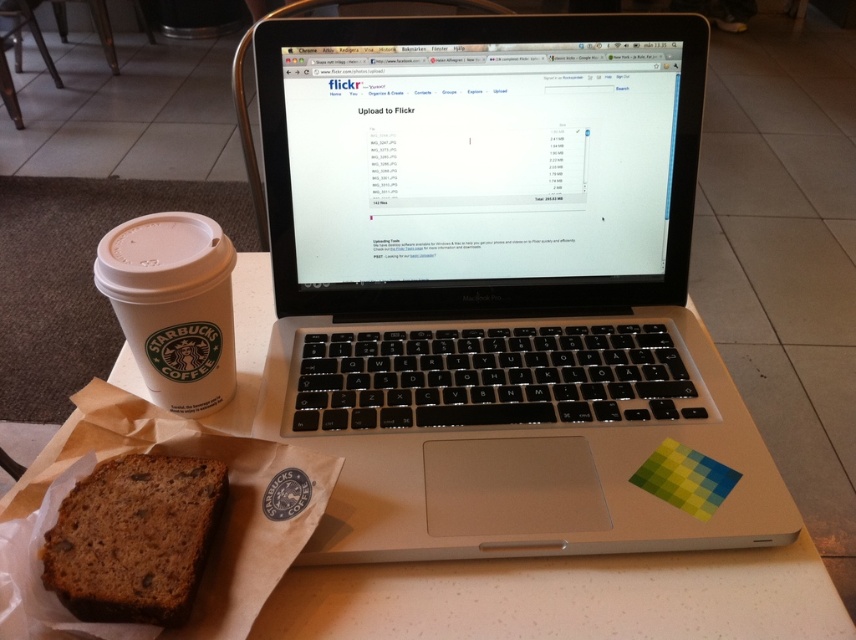
Question: Which object is farther from the camera taking this photo?

Choices:
 (A) brown crumbly bread at lower left
 (B) silver/black plastic laptop at center

Answer: (B)

Question: Is white paper napkin at lower left wider than white matte cup at left?

Choices:
 (A) no
 (B) yes

Answer: (B)

Question: Which point is closer to the camera?

Choices:
 (A) white matte cup at left
 (B) silver/black plastic laptop at center
 (C) white paper napkin at lower left
 (D) brown crumbly bread at lower left

Answer: (D)

Question: Which of the following is the closest to the observer?

Choices:
 (A) brown crumbly bread at lower left
 (B) white paper napkin at lower left
 (C) white matte cup at left
 (D) silver/black plastic laptop at center

Answer: (A)

Question: Is brown crumbly bread at lower left positioned in front of white matte cup at left?

Choices:
 (A) no
 (B) yes

Answer: (B)

Question: Can you confirm if white paper napkin at lower left is positioned to the right of brown crumbly bread at lower left?

Choices:
 (A) yes
 (B) no

Answer: (A)